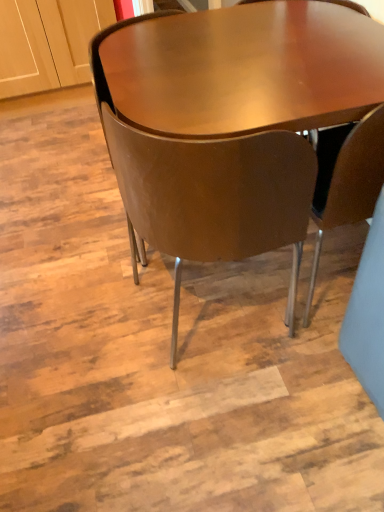
The height and width of the screenshot is (512, 384). In order to click on free location to the left of brown leather chair at center, which is counted as the second chair, starting from the left in this screenshot , I will do `click(100, 324)`.